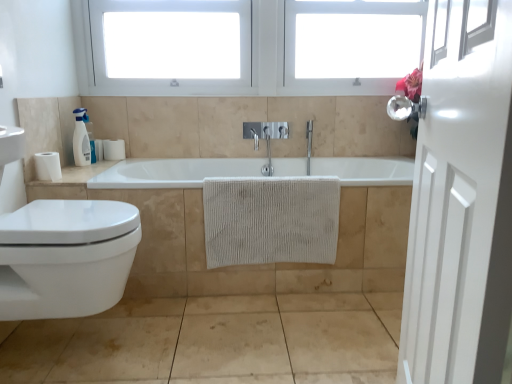
Question: Is white glossy soap dispenser at upper left looking in the opposite direction of white matte toilet paper at left, positioned as the 1th toilet paper in top-to-bottom order?

Choices:
 (A) no
 (B) yes

Answer: (A)

Question: Is white matte toilet paper at left, which is counted as the 1th toilet paper, starting from the back, completely or partially inside white glossy soap dispenser at upper left?

Choices:
 (A) yes
 (B) no

Answer: (B)

Question: From a real-world perspective, is white glossy soap dispenser at upper left located higher than white matte toilet paper at left, arranged as the second toilet paper when viewed from the left?

Choices:
 (A) yes
 (B) no

Answer: (A)

Question: Is white glossy soap dispenser at upper left positioned behind white matte toilet paper at left, arranged as the second toilet paper when viewed from the left?

Choices:
 (A) yes
 (B) no

Answer: (B)

Question: Can you confirm if white glossy soap dispenser at upper left is positioned to the left of white matte toilet paper at left, which is the 2th toilet paper from front to back?

Choices:
 (A) no
 (B) yes

Answer: (B)

Question: Is white glossy soap dispenser at upper left shorter than white matte toilet paper at left, arranged as the second toilet paper when viewed from the left?

Choices:
 (A) yes
 (B) no

Answer: (B)

Question: Is white plastic window frame at upper center, arranged as the second window frame when viewed from the left, smaller than white glossy toilet at lower left?

Choices:
 (A) no
 (B) yes

Answer: (A)

Question: Can you confirm if white plastic window frame at upper center, arranged as the second window frame when viewed from the left, is taller than white glossy toilet at lower left?

Choices:
 (A) no
 (B) yes

Answer: (B)

Question: Does white plastic window frame at upper center, arranged as the second window frame when viewed from the left, appear on the left side of white glossy toilet at lower left?

Choices:
 (A) yes
 (B) no

Answer: (B)

Question: Is white plastic window frame at upper center, arranged as the second window frame when viewed from the left, not close to white glossy toilet at lower left?

Choices:
 (A) yes
 (B) no

Answer: (A)

Question: From the image's perspective, is white plastic window frame at upper center, arranged as the second window frame when viewed from the left, below white glossy toilet at lower left?

Choices:
 (A) no
 (B) yes

Answer: (A)

Question: Does white plastic window frame at upper center, arranged as the second window frame when viewed from the left, have a lesser width compared to white glossy toilet at lower left?

Choices:
 (A) yes
 (B) no

Answer: (A)

Question: Is white plastic window frame at upper center, the first window frame positioned from the right, turned away from beige textured towel at center?

Choices:
 (A) no
 (B) yes

Answer: (A)